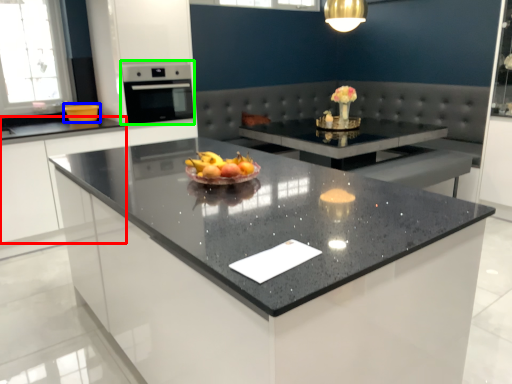
Question: Considering the real-world distances, which object is closest to cabinetry (highlighted by a red box)? kitchen appliance (highlighted by a blue box) or home appliance (highlighted by a green box).

Choices:
 (A) kitchen appliance
 (B) home appliance

Answer: (A)